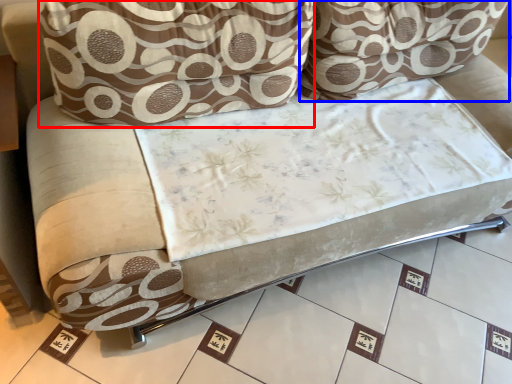
Question: Which object appears closest to the camera in this image, throw pillow (highlighted by a red box) or throw pillow (highlighted by a blue box)?

Choices:
 (A) throw pillow
 (B) throw pillow

Answer: (A)